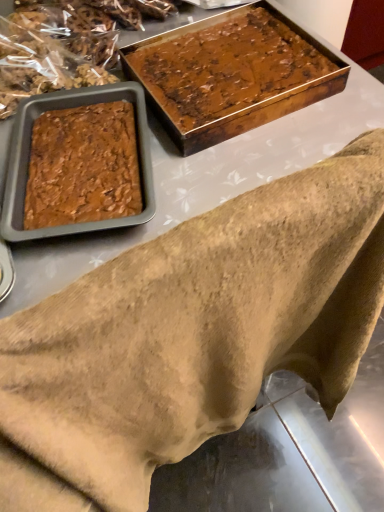
Question: Is brown fuzzy blanket at lower left a part of shiny brown cake at upper right?

Choices:
 (A) no
 (B) yes

Answer: (A)

Question: Is shiny brown cake at upper right closer to the viewer compared to brown fuzzy blanket at lower left?

Choices:
 (A) no
 (B) yes

Answer: (A)

Question: Considering the relative sizes of shiny brown cake at upper right and brown fuzzy blanket at lower left in the image provided, is shiny brown cake at upper right shorter than brown fuzzy blanket at lower left?

Choices:
 (A) no
 (B) yes

Answer: (B)

Question: From a real-world perspective, is shiny brown cake at upper right below brown fuzzy blanket at lower left?

Choices:
 (A) yes
 (B) no

Answer: (B)

Question: From a real-world perspective, does shiny brown cake at upper right stand above brown fuzzy blanket at lower left?

Choices:
 (A) yes
 (B) no

Answer: (A)

Question: From the image's perspective, is shiny brown cake at upper right above brown fuzzy blanket at lower left?

Choices:
 (A) yes
 (B) no

Answer: (A)

Question: Can you confirm if brown fuzzy blanket at lower left is shorter than shiny brown cake at upper right?

Choices:
 (A) no
 (B) yes

Answer: (A)

Question: Can you confirm if brown fuzzy blanket at lower left is smaller than shiny brown cake at upper right?

Choices:
 (A) no
 (B) yes

Answer: (A)

Question: From a real-world perspective, is brown fuzzy blanket at lower left under shiny brown cake at upper right?

Choices:
 (A) yes
 (B) no

Answer: (A)

Question: Is brown fuzzy blanket at lower left further to the viewer compared to shiny brown cake at upper right?

Choices:
 (A) yes
 (B) no

Answer: (B)

Question: Is brown fuzzy blanket at lower left facing towards shiny brown cake at upper right?

Choices:
 (A) yes
 (B) no

Answer: (A)

Question: From the image's perspective, is brown fuzzy blanket at lower left beneath shiny brown cake at upper right?

Choices:
 (A) no
 (B) yes

Answer: (B)

Question: Based on their sizes in the image, would you say brown fuzzy blanket at lower left is bigger or smaller than shiny brown cake at upper right?

Choices:
 (A) big
 (B) small

Answer: (A)